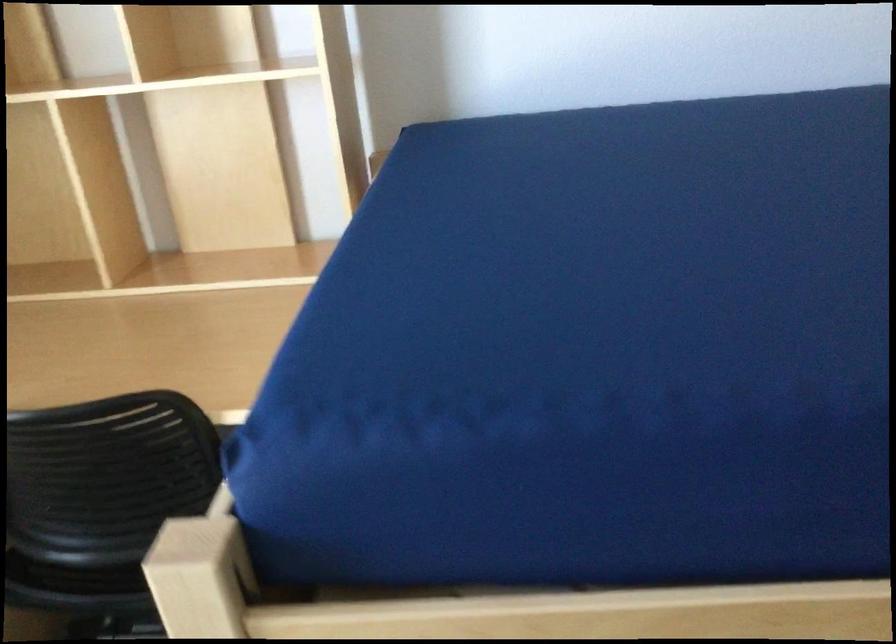
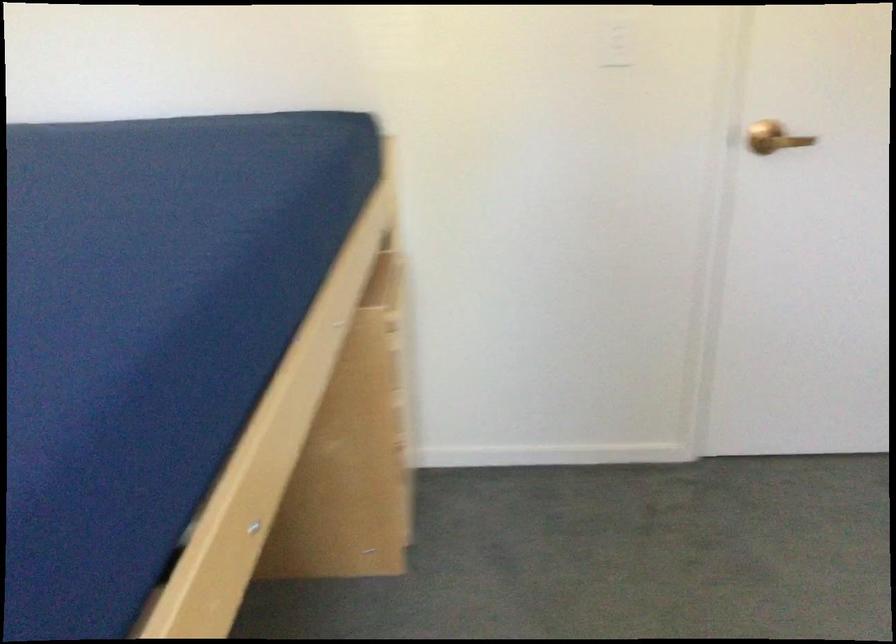
The first image is from the beginning of the video and the second image is from the end. How did the camera likely rotate when shooting the video?

The camera's rotation is toward right-down.